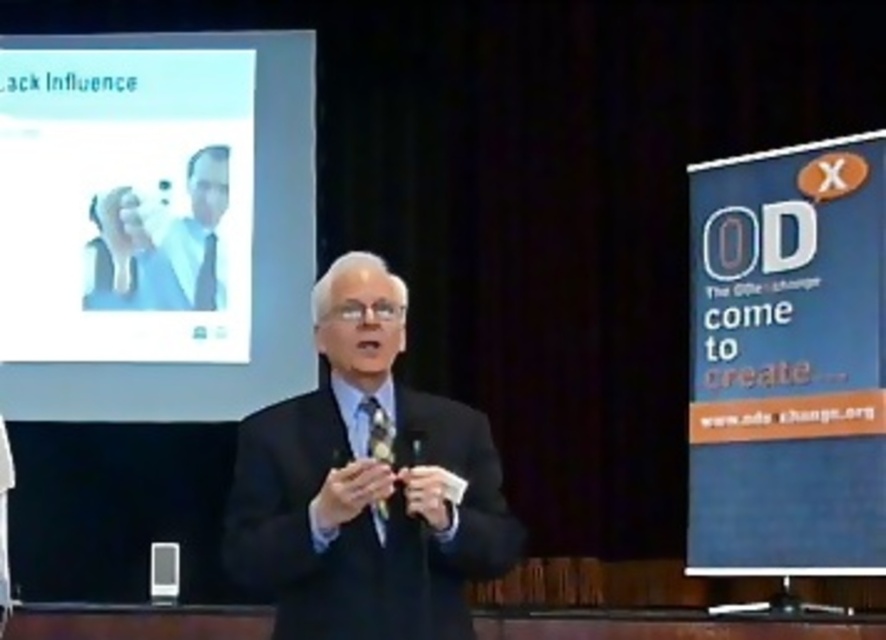
What is located at the coordinates point (789, 360)?

The blue paper at right is located at point (789, 360).

You are an attendee sitting in the front row of the conference. You notice two points marked in the scene. The first point is at coordinate point (x=271, y=362) and the second point is at coordinate point (x=383, y=428). Which point is closer to you?

Point (x=271, y=362) is closer to you because it is further to the viewer than point (x=383, y=428).